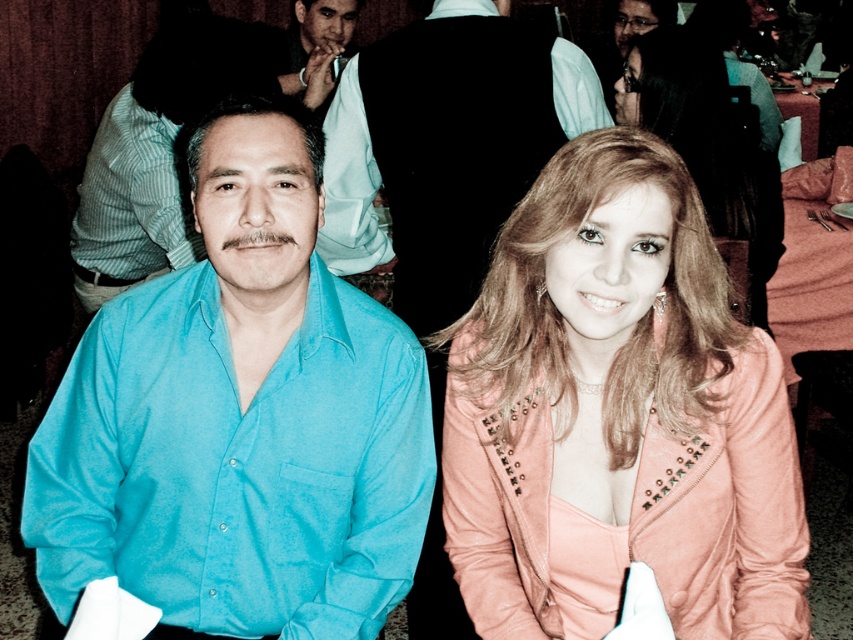
You are a photographer at the event and want to ensure both the turquoise fabric shirt at left and the teal smooth shirt at left are visible in your photo. Given their positions, which shirt should you focus on to capture both in the frame?

The turquoise fabric shirt at left is below the teal smooth shirt at left, so focusing on the teal smooth shirt at left would allow both shirts to be captured in the frame since the turquoise one is positioned lower.

You are standing at the entrance of the event and want to locate the turquoise shirt at center. According to the coordinates provided, in which direction should you look relative to the center of the image?

The turquoise shirt at center is located at coordinates point 0.659 on the x axis and 0.279 on the y axis. Since the x value is greater than 0.5, it is to the right of center, and the y value is less than 0.5, it is below the center. So you should look to the right and slightly downward from the center of the image.